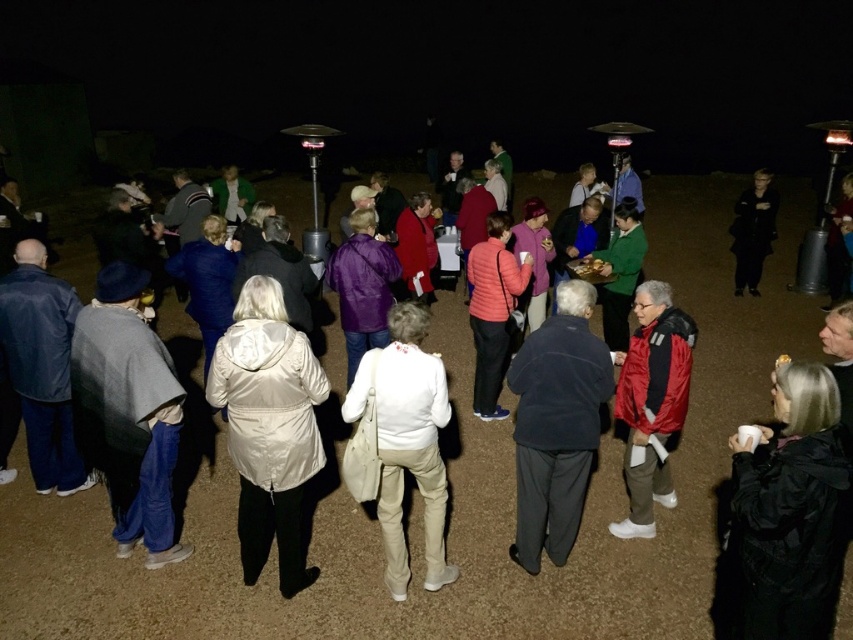
Question: Which point is closer to the camera?

Choices:
 (A) (38, 339)
 (B) (811, 532)
 (C) (762, 179)

Answer: (B)

Question: Can you confirm if black matte jacket at lower right is wider than denim jacket at lower left?

Choices:
 (A) no
 (B) yes

Answer: (A)

Question: Considering the relative positions of black matte jacket at lower right and dark blue fleece jacket at center in the image provided, where is black matte jacket at lower right located with respect to dark blue fleece jacket at center?

Choices:
 (A) above
 (B) below

Answer: (B)

Question: Which object is farther from the camera taking this photo?

Choices:
 (A) black matte jacket at lower right
 (B) black leather jacket at right
 (C) matte pink jacket at center
 (D) white glossy coat at center

Answer: (B)

Question: Can you confirm if white glossy coat at center is bigger than matte pink jacket at center?

Choices:
 (A) no
 (B) yes

Answer: (B)

Question: Estimate the real-world distances between objects in this image. Which object is closer to the black matte jacket at lower right?

Choices:
 (A) red matte jacket at center
 (B) denim jacket at lower left

Answer: (A)